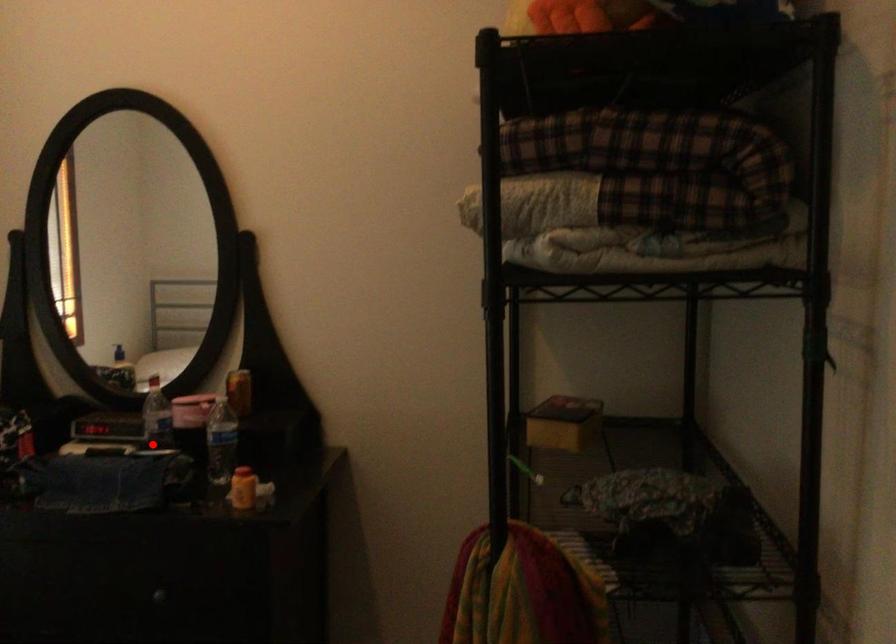
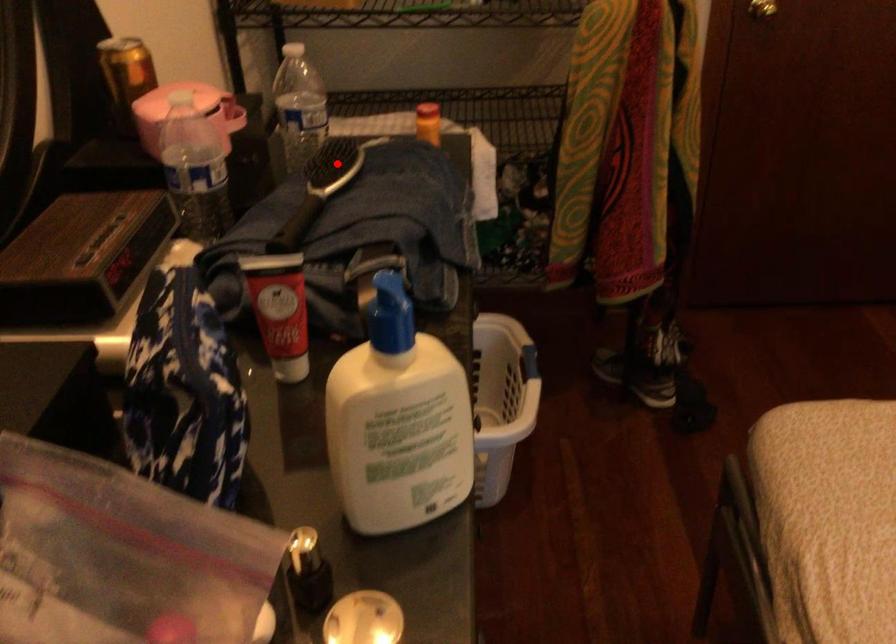
I am providing you with two images of the same scene from different viewpoints. A red point is marked on the first image and another point is marked on the second image. Is the red point in image1 aligned with the point shown in image2?

Yes